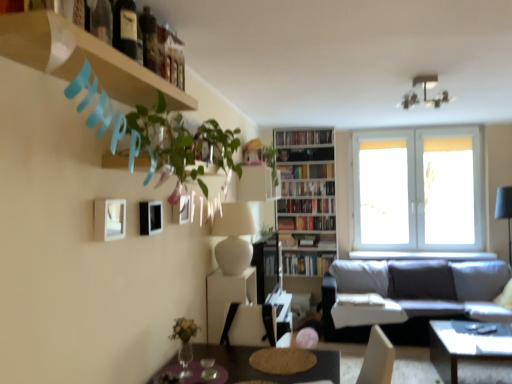
Question: Visually, is wooden shelf at upper left positioned to the left or to the right of hardcover books at upper center, which is the sixth book in bottom-to-top order?

Choices:
 (A) left
 (B) right

Answer: (A)

Question: From a real-world perspective, is wooden shelf at upper left positioned above or below hardcover books at upper center, which is the first book in top-to-bottom order?

Choices:
 (A) below
 (B) above

Answer: (A)

Question: Which object is positioned closest to the green glass wine bottle at upper left, acting as the third wine bottle starting from the back?

Choices:
 (A) white glass window at upper right
 (B) hardcover book at center, which is counted as the second book, starting from the top
 (C) white wooden bookcase at center
 (D) gray fabric couch at lower right
 (E) shiny black coffee table at lower right

Answer: (E)

Question: Considering the real-world distances, which object is farthest from the gray fabric couch at lower right?

Choices:
 (A) dark glass wine bottle at upper left, the second wine bottle from the back
 (B) hardcover book at center, the fifth book when ordered from top to bottom
 (C) wooden shelf at upper left
 (D) dark glass wine bottle at upper left, positioned as the 3th wine bottle in front-to-back order
 (E) hardcover books at upper center, which is the first book in top-to-bottom order

Answer: (A)